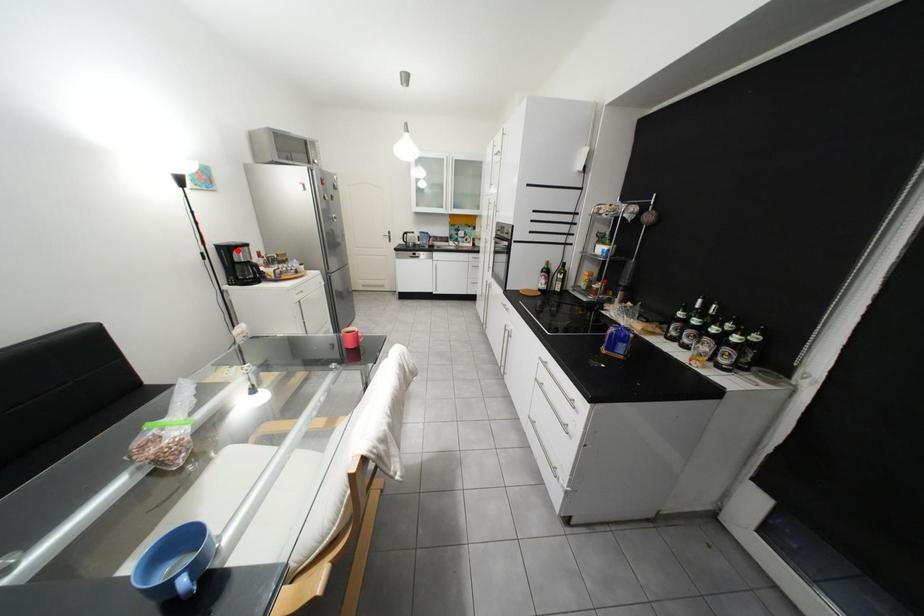
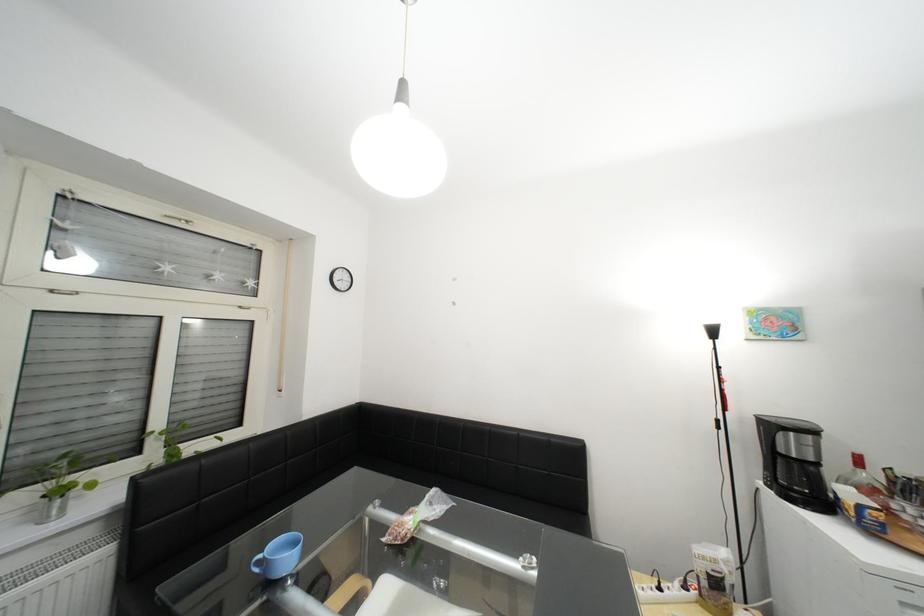
Locate, in the second image, the point that corresponds to the highlighted location in the first image.

(782, 428)